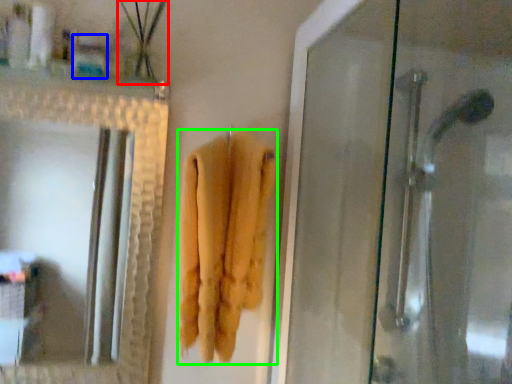
Question: Estimate the real-world distances between objects in this image. Which object is closer to plant (highlighted by a red box), toiletry (highlighted by a blue box) or towel (highlighted by a green box)?

Choices:
 (A) toiletry
 (B) towel

Answer: (A)